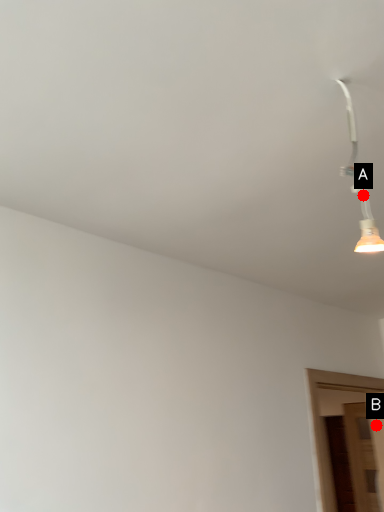
Question: Two points are circled on the image, labeled by A and B beside each circle. Which of the following is the farthest from the observer?

Choices:
 (A) A is further
 (B) B is further

Answer: (B)